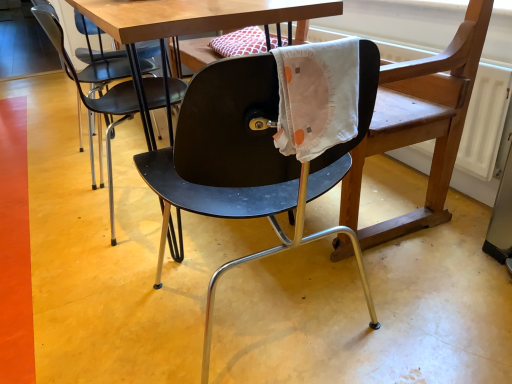
I want to click on matte black chair at center, marked as the 1th chair in a right-to-left arrangement, so click(248, 160).

Image resolution: width=512 pixels, height=384 pixels. Describe the element at coordinates (420, 124) in the screenshot. I see `matte black swivel chair at center` at that location.

This screenshot has height=384, width=512. I want to click on matte black chair at center, which appears as the 1th chair when viewed from the left, so click(92, 98).

From the image's perspective, between matte black swivel chair at center and matte black chair at center, acting as the second chair starting from the right, who is located below?

From the image's view, matte black chair at center, acting as the second chair starting from the right, is below.

Is matte black swivel chair at center not close to matte black chair at center, acting as the second chair starting from the right?

No, matte black swivel chair at center is not far away from matte black chair at center, acting as the second chair starting from the right.

Identify the location of the 2nd chair to the left when counting from the matte black swivel chair at center. This screenshot has width=512, height=384. (92, 98).

Is matte black chair at center, marked as the 1th chair in a right-to-left arrangement, located within matte black swivel chair at center?

No, matte black chair at center, marked as the 1th chair in a right-to-left arrangement, is not a part of matte black swivel chair at center.

From a real-world perspective, relative to matte black chair at center, the second chair viewed from the left, is matte black swivel chair at center vertically above or below?

matte black swivel chair at center is situated higher than matte black chair at center, the second chair viewed from the left, in the real world.

The image size is (512, 384). Find the location of `swivel chair that appears above the matte black chair at center, marked as the 1th chair in a right-to-left arrangement (from a real-world perspective)`. swivel chair that appears above the matte black chair at center, marked as the 1th chair in a right-to-left arrangement (from a real-world perspective) is located at coordinates (420, 124).

In terms of height, does matte black swivel chair at center look taller or shorter compared to matte black chair at center, the second chair viewed from the left?

Considering their sizes, matte black swivel chair at center has more height than matte black chair at center, the second chair viewed from the left.

From the picture: Is matte black swivel chair at center at the back of matte black chair at center, marked as the 1th chair in a right-to-left arrangement?

No, matte black chair at center, marked as the 1th chair in a right-to-left arrangement, is not facing the opposite direction of matte black swivel chair at center.

From the image's perspective, is matte black chair at center, marked as the 1th chair in a right-to-left arrangement, under matte black swivel chair at center?

Yes, from the image's perspective, matte black chair at center, marked as the 1th chair in a right-to-left arrangement, is below matte black swivel chair at center.

Which is behind, matte black chair at center, marked as the 1th chair in a right-to-left arrangement, or matte black swivel chair at center?

matte black swivel chair at center is further away from the camera.

Is the surface of matte black chair at center, which appears as the 1th chair when viewed from the left, in direct contact with matte black chair at center, the second chair viewed from the left?

No.

Which of these two, matte black chair at center, acting as the second chair starting from the right, or matte black chair at center, marked as the 1th chair in a right-to-left arrangement, is bigger?

matte black chair at center, marked as the 1th chair in a right-to-left arrangement.

Considering the points (131, 104) and (279, 167), which point is behind, point (131, 104) or point (279, 167)?

The point (131, 104) is farther.

In terms of height, does matte black chair at center, which appears as the 1th chair when viewed from the left, look taller or shorter compared to matte black chair at center, marked as the 1th chair in a right-to-left arrangement?

Considering their sizes, matte black chair at center, which appears as the 1th chair when viewed from the left, has less height than matte black chair at center, marked as the 1th chair in a right-to-left arrangement.

Which is in front, matte black chair at center, the second chair viewed from the left, or matte black chair at center, acting as the second chair starting from the right?

matte black chair at center, the second chair viewed from the left, is in front.

Is matte black chair at center, marked as the 1th chair in a right-to-left arrangement, directly adjacent to matte black chair at center, which appears as the 1th chair when viewed from the left?

No.

Who is bigger, matte black chair at center, marked as the 1th chair in a right-to-left arrangement, or matte black chair at center, which appears as the 1th chair when viewed from the left?

matte black chair at center, marked as the 1th chair in a right-to-left arrangement, is bigger.

Is matte black chair at center, marked as the 1th chair in a right-to-left arrangement, facing away from matte black chair at center, which appears as the 1th chair when viewed from the left?

matte black chair at center, marked as the 1th chair in a right-to-left arrangement, is not turned away from matte black chair at center, which appears as the 1th chair when viewed from the left.

Is matte black chair at center, which appears as the 1th chair when viewed from the left, further to the viewer compared to matte black swivel chair at center?

Yes, matte black chair at center, which appears as the 1th chair when viewed from the left, is behind matte black swivel chair at center.

Could you tell me if matte black chair at center, acting as the second chair starting from the right, is turned towards matte black swivel chair at center?

Yes, matte black chair at center, acting as the second chair starting from the right, is oriented towards matte black swivel chair at center.

Consider the image. Are matte black chair at center, which appears as the 1th chair when viewed from the left, and matte black swivel chair at center beside each other?

There is a gap between matte black chair at center, which appears as the 1th chair when viewed from the left, and matte black swivel chair at center.

Can you tell me how much matte black chair at center, which appears as the 1th chair when viewed from the left, and matte black swivel chair at center differ in facing direction?

179 degrees separate the facing orientations of matte black chair at center, which appears as the 1th chair when viewed from the left, and matte black swivel chair at center.

From a real-world perspective, count 2nd chairs downward from the matte black swivel chair at center and point to it. Please provide its 2D coordinates.

[(92, 98)]

Locate an element on the screen. chair located in front of the matte black swivel chair at center is located at coordinates (248, 160).

Based on their spatial positions, is matte black chair at center, which appears as the 1th chair when viewed from the left, or matte black swivel chair at center closer to matte black chair at center, the second chair viewed from the left?

Among the two, matte black swivel chair at center is located nearer to matte black chair at center, the second chair viewed from the left.

Estimate the real-world distances between objects in this image. Which object is further from matte black swivel chair at center, matte black chair at center, marked as the 1th chair in a right-to-left arrangement, or matte black chair at center, which appears as the 1th chair when viewed from the left?

The object further to matte black swivel chair at center is matte black chair at center, which appears as the 1th chair when viewed from the left.

Estimate the real-world distances between objects in this image. Which object is further from matte black chair at center, which appears as the 1th chair when viewed from the left, matte black chair at center, the second chair viewed from the left, or matte black swivel chair at center?

Among the two, matte black swivel chair at center is located further to matte black chair at center, which appears as the 1th chair when viewed from the left.

Considering their positions, is matte black chair at center, which appears as the 1th chair when viewed from the left, positioned further to matte black swivel chair at center than matte black chair at center, marked as the 1th chair in a right-to-left arrangement?

matte black chair at center, which appears as the 1th chair when viewed from the left, lies further to matte black swivel chair at center than the other object.

Estimate the real-world distances between objects in this image. Which object is further from matte black chair at center, which appears as the 1th chair when viewed from the left, matte black swivel chair at center or matte black chair at center, marked as the 1th chair in a right-to-left arrangement?

matte black swivel chair at center is further to matte black chair at center, which appears as the 1th chair when viewed from the left.

Based on their spatial positions, is matte black swivel chair at center or matte black chair at center, acting as the second chair starting from the right, further from matte black chair at center, the second chair viewed from the left?

Based on the image, matte black chair at center, acting as the second chair starting from the right, appears to be further to matte black chair at center, the second chair viewed from the left.

Find the location of a particular element. This screenshot has width=512, height=384. chair located between matte black chair at center, which appears as the 1th chair when viewed from the left, and matte black swivel chair at center in the left-right direction is located at coordinates tap(248, 160).